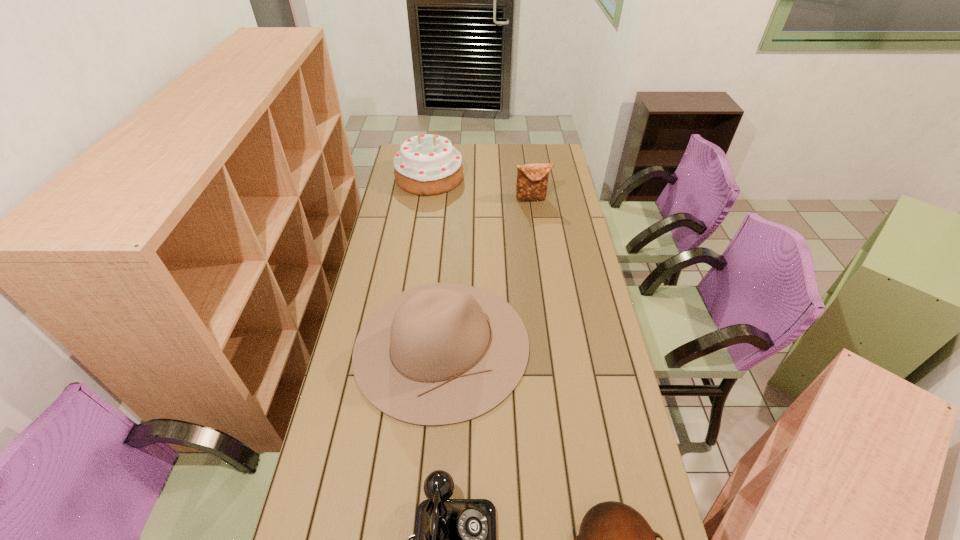
Identify the location of vacant point located between the third nearest object and the cake. Image resolution: width=960 pixels, height=540 pixels. 436,261.

Identify the location of object that is the third nearest to the plate. [532, 179].

Image resolution: width=960 pixels, height=540 pixels. I want to click on the closest object to the telephone, so click(459, 351).

The height and width of the screenshot is (540, 960). I want to click on vacant space that satisfies the following two spatial constraints: 1. on the front side of the sombrero; 2. on the right side of the cake, so click(404, 346).